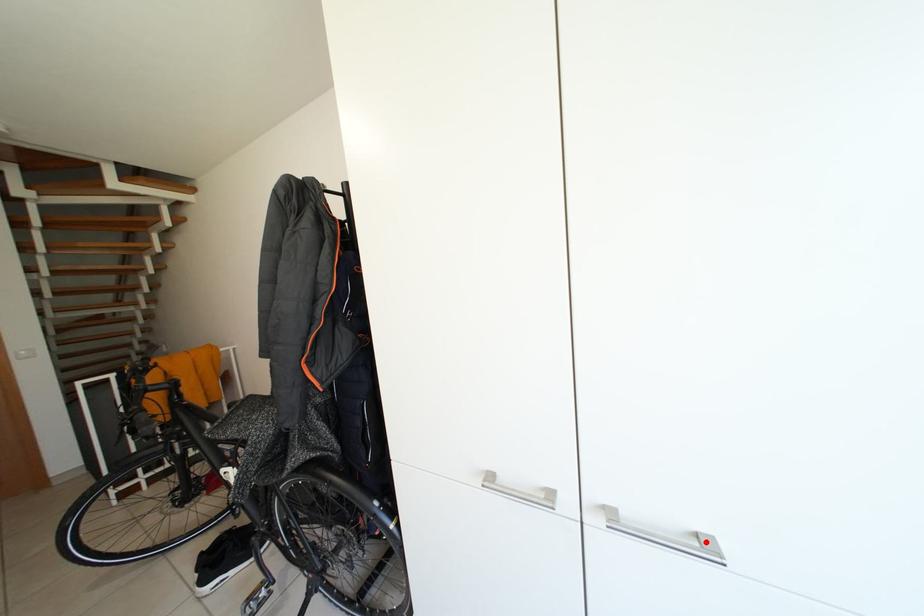
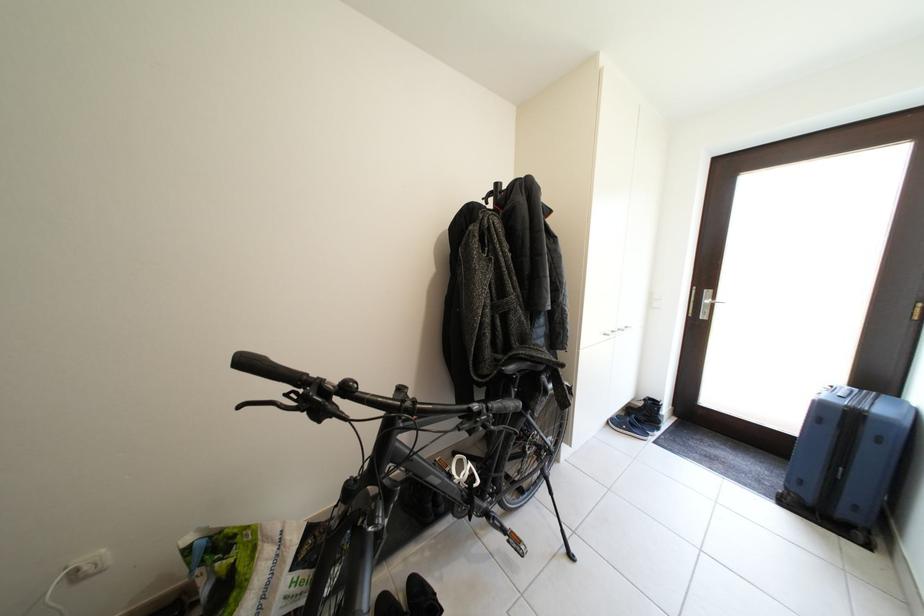
Question: I am providing you with two images of the same scene from different viewpoints. A red point is marked on the first image. Is the red point's position out of view in image 2?

Choices:
 (A) Yes
 (B) No

Answer: (A)